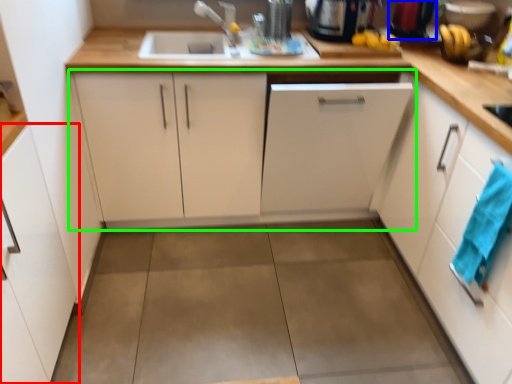
Question: Which is farther away from cabinetry (highlighted by a red box)? appliance (highlighted by a blue box) or cabinetry (highlighted by a green box)?

Choices:
 (A) appliance
 (B) cabinetry

Answer: (A)